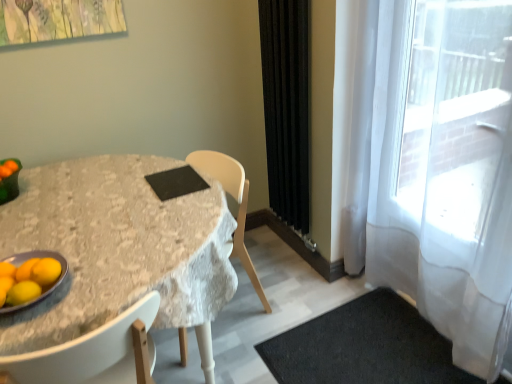
This screenshot has width=512, height=384. I want to click on blank space above metallic gray platter at lower left (from a real-world perspective), so click(29, 273).